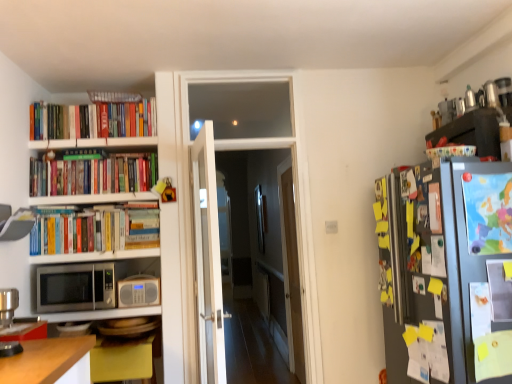
Find the location of a particular element. The height and width of the screenshot is (384, 512). metallic silver coffee machine at lower left is located at coordinates pyautogui.click(x=16, y=325).

Locate an element on the screen. The image size is (512, 384). silver metallic microwave at lower left is located at coordinates (75, 287).

This screenshot has width=512, height=384. What do you see at coordinates (75, 287) in the screenshot? I see `silver metallic microwave at lower left` at bounding box center [75, 287].

How much space does clear glass door at center, which is the second glass door in back-to-front order, occupy vertically?

2.33 meters.

Where is `hardcover books at left, positioned as the 3th book in top-to-bottom order`? The image size is (512, 384). hardcover books at left, positioned as the 3th book in top-to-bottom order is located at coordinates (95, 228).

In order to face yellow matte table at lower left, should I rotate leftwards or rightwards?

It's best to rotate left around 18.150 degrees.

Identify the location of yellow matte table at lower left. (122, 360).

Where is `beige plastic radio at left`? Image resolution: width=512 pixels, height=384 pixels. beige plastic radio at left is located at coordinates (138, 291).

Is hardcover books at upper left, marked as the third book in a bottom-to-top arrangement, not near yellow matte table at lower left?

Yes, hardcover books at upper left, marked as the third book in a bottom-to-top arrangement, and yellow matte table at lower left are located far from each other.

From the image's perspective, is hardcover books at upper left, marked as the third book in a bottom-to-top arrangement, beneath yellow matte table at lower left?

No, from the image's perspective, hardcover books at upper left, marked as the third book in a bottom-to-top arrangement, is not beneath yellow matte table at lower left.

In the scene shown: Is hardcover books at upper left, marked as the third book in a bottom-to-top arrangement, not inside yellow matte table at lower left?

That's correct, hardcover books at upper left, marked as the third book in a bottom-to-top arrangement, is outside of yellow matte table at lower left.

Considering the points (130, 114) and (103, 340), which point is behind, point (130, 114) or point (103, 340)?

The point (130, 114) is farther.

Between silver metallic microwave at lower left and transparent glass door at center, the second glass door positioned from the front, which one has larger size?

transparent glass door at center, the second glass door positioned from the front.

Is silver metallic microwave at lower left positioned far away from transparent glass door at center, the second glass door positioned from the front?

silver metallic microwave at lower left is positioned a significant distance from transparent glass door at center, the second glass door positioned from the front.

Which object is closer to the camera, silver metallic microwave at lower left or transparent glass door at center, the first glass door in the back-to-front sequence?

silver metallic microwave at lower left is more forward.

The image size is (512, 384). Find the location of `glass door that is the 2nd object to the right of the silver metallic microwave at lower left, starting at the anchor`. glass door that is the 2nd object to the right of the silver metallic microwave at lower left, starting at the anchor is located at coordinates (291, 270).

Who is bigger, metallic silver coffee machine at lower left or white glass door at center?

With larger size is white glass door at center.

Looking at this image, is metallic silver coffee machine at lower left oriented towards white glass door at center?

No, metallic silver coffee machine at lower left is not facing towards white glass door at center.

Which is farther, (246, 191) or (215, 219)?

Point (246, 191)

From the image's perspective, which one is positioned higher, clear glass door at center, which is the second glass door in back-to-front order, or white glass door at center?

clear glass door at center, which is the second glass door in back-to-front order, from the image's perspective.

Considering the relative sizes of clear glass door at center, arranged as the first glass door when viewed from the left, and white glass door at center in the image provided, is clear glass door at center, arranged as the first glass door when viewed from the left, thinner than white glass door at center?

Yes.

Which is more to the right, clear glass door at center, which appears as the 1th glass door when viewed from the front, or white glass door at center?

clear glass door at center, which appears as the 1th glass door when viewed from the front, is more to the right.

Is hardcover books at left, positioned as the 3th book in top-to-bottom order, to the left or to the right of transparent glass door at center, the first glass door in the back-to-front sequence, in the image?

Based on their positions, hardcover books at left, positioned as the 3th book in top-to-bottom order, is located to the left of transparent glass door at center, the first glass door in the back-to-front sequence.

Considering the sizes of objects hardcover books at left, placed as the 1th book when sorted from bottom to top, and transparent glass door at center, which is counted as the 2th glass door, starting from the left, in the image provided, who is thinner, hardcover books at left, placed as the 1th book when sorted from bottom to top, or transparent glass door at center, which is counted as the 2th glass door, starting from the left,?

With smaller width is transparent glass door at center, which is counted as the 2th glass door, starting from the left.

Is hardcover books at left, placed as the 1th book when sorted from bottom to top, in contact with transparent glass door at center, the first glass door in the back-to-front sequence?

hardcover books at left, placed as the 1th book when sorted from bottom to top, and transparent glass door at center, the first glass door in the back-to-front sequence, are not in contact.

Would you say transparent glass door at center, which is counted as the 2th glass door, starting from the left, is part of hardcover books at left, placed as the 1th book when sorted from bottom to top,'s contents?

No, transparent glass door at center, which is counted as the 2th glass door, starting from the left, is not surrounded by hardcover books at left, placed as the 1th book when sorted from bottom to top.

Is beige plastic radio at left shorter than hardcover books at left, positioned as the 3th book in top-to-bottom order?

Yes.

Is beige plastic radio at left in front of hardcover books at left, placed as the 1th book when sorted from bottom to top?

No.

Is beige plastic radio at left aimed at hardcover books at left, placed as the 1th book when sorted from bottom to top?

No, beige plastic radio at left does not turn towards hardcover books at left, placed as the 1th book when sorted from bottom to top.

Can you confirm if hardcover books at left, positioned as the 3th book in top-to-bottom order, is taller than silver metallic microwave at lower left?

Indeed, hardcover books at left, positioned as the 3th book in top-to-bottom order, has a greater height compared to silver metallic microwave at lower left.

Which of these two, hardcover books at left, positioned as the 3th book in top-to-bottom order, or silver metallic microwave at lower left, is wider?

silver metallic microwave at lower left.

Locate an element on the screen. The width and height of the screenshot is (512, 384). table in front of the hardcover books at upper left, marked as the third book in a bottom-to-top arrangement is located at coordinates pos(122,360).

Image resolution: width=512 pixels, height=384 pixels. I want to click on glass door directly beneath the silver metallic microwave at lower left (from a real-world perspective), so click(x=291, y=270).

When comparing their distances from white glass door at center, does silver metallic microwave at lower left or hardcover books at upper left, the 1th book in the top-to-bottom sequence, seem further?

Based on the image, hardcover books at upper left, the 1th book in the top-to-bottom sequence, appears to be further to white glass door at center.

Which object lies nearer to the anchor point silver metallic microwave at lower left, metallic silver coffee machine at lower left or hardcover books at left, placed as the 1th book when sorted from bottom to top?

hardcover books at left, placed as the 1th book when sorted from bottom to top, lies closer to silver metallic microwave at lower left than the other object.

Based on their spatial positions, is white glass door at center or yellow matte table at lower left closer to colorful ceramic bowl at upper right?

Among the two, white glass door at center is located nearer to colorful ceramic bowl at upper right.

When comparing their distances from beige plastic radio at left, does hardcover books at left, placed as the 1th book when sorted from bottom to top, or hardcover books at upper left, acting as the second book starting from the bottom, seem closer?

hardcover books at left, placed as the 1th book when sorted from bottom to top, is closer to beige plastic radio at left.

Based on their spatial positions, is white glass door at center or metallic silver coffee machine at lower left further from hardcover books at upper left, acting as the second book starting from the bottom?

Based on the image, metallic silver coffee machine at lower left appears to be further to hardcover books at upper left, acting as the second book starting from the bottom.

From the image, which object appears to be farther from transparent glass door at center, the second glass door positioned from the front, white glass door at center or beige plastic radio at left?

Among the two, beige plastic radio at left is located further to transparent glass door at center, the second glass door positioned from the front.

Considering their positions, is hardcover books at upper left, marked as the third book in a bottom-to-top arrangement, positioned closer to white glass door at center than transparent glass door at center, the first glass door in the back-to-front sequence?

hardcover books at upper left, marked as the third book in a bottom-to-top arrangement.

When comparing their distances from colorful ceramic bowl at upper right, does white glass door at center or transparent glass door at center, which is counted as the 2th glass door, starting from the left, seem closer?

white glass door at center.

This screenshot has width=512, height=384. I want to click on door between silver metallic microwave at lower left and colorful ceramic bowl at upper right from left to right, so click(x=208, y=259).

The height and width of the screenshot is (384, 512). What are the coordinates of `door between silver metallic microwave at lower left and clear glass door at center, which is the second glass door in back-to-front order, from left to right` in the screenshot? It's located at click(208, 259).

Where is `glass door between hardcover books at upper left, the 1th book in the top-to-bottom sequence, and beige plastic radio at left, in the vertical direction`? glass door between hardcover books at upper left, the 1th book in the top-to-bottom sequence, and beige plastic radio at left, in the vertical direction is located at coordinates (262, 231).

In order to click on table located between hardcover books at left, positioned as the 3th book in top-to-bottom order, and colorful ceramic bowl at upper right in the left-right direction in this screenshot , I will do `click(122, 360)`.